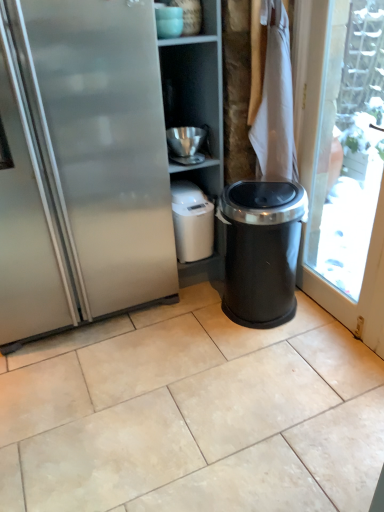
Question: Is black plastic trash can at right facing towards matte ceramic bowl at upper center, acting as the 3th appliance starting from the bottom?

Choices:
 (A) no
 (B) yes

Answer: (A)

Question: From the image's perspective, is black plastic trash can at right under matte ceramic bowl at upper center, marked as the 1th appliance in a front-to-back arrangement?

Choices:
 (A) yes
 (B) no

Answer: (A)

Question: Is black plastic trash can at right to the right of matte ceramic bowl at upper center, marked as the 1th appliance in a front-to-back arrangement, from the viewer's perspective?

Choices:
 (A) no
 (B) yes

Answer: (B)

Question: Is the position of black plastic trash can at right more distant than that of matte ceramic bowl at upper center, which is the third appliance in back-to-front order?

Choices:
 (A) no
 (B) yes

Answer: (A)

Question: Does black plastic trash can at right have a lesser height compared to matte ceramic bowl at upper center, marked as the 1th appliance in a front-to-back arrangement?

Choices:
 (A) yes
 (B) no

Answer: (B)

Question: Is black plastic trash can at right taller than matte ceramic bowl at upper center, acting as the 3th appliance starting from the bottom?

Choices:
 (A) yes
 (B) no

Answer: (A)

Question: Considering the relative sizes of metallic silver bowl at upper center, marked as the 2th appliance in a top-to-bottom arrangement, and matte ceramic bowl at upper center, the first appliance from the top, in the image provided, is metallic silver bowl at upper center, marked as the 2th appliance in a top-to-bottom arrangement, wider than matte ceramic bowl at upper center, the first appliance from the top,?

Choices:
 (A) yes
 (B) no

Answer: (A)

Question: Is metallic silver bowl at upper center, positioned as the second appliance in front-to-back order, bigger than matte ceramic bowl at upper center, the first appliance from the top?

Choices:
 (A) no
 (B) yes

Answer: (B)

Question: From the image's perspective, is metallic silver bowl at upper center, which appears as the second appliance when viewed from the back, above matte ceramic bowl at upper center, which is the third appliance in back-to-front order?

Choices:
 (A) yes
 (B) no

Answer: (B)

Question: Is metallic silver bowl at upper center, which appears as the second appliance when viewed from the back, touching matte ceramic bowl at upper center, the first appliance from the top?

Choices:
 (A) no
 (B) yes

Answer: (A)

Question: Can matte ceramic bowl at upper center, the first appliance from the top, be found inside metallic silver bowl at upper center, which appears as the second appliance when viewed from the back?

Choices:
 (A) yes
 (B) no

Answer: (B)

Question: Is metallic silver bowl at upper center, which ranks as the second appliance in bottom-to-top order, located outside matte ceramic bowl at upper center, acting as the 3th appliance starting from the bottom?

Choices:
 (A) no
 (B) yes

Answer: (B)

Question: From the image's perspective, is black plastic trash can at right on white fabric at upper right?

Choices:
 (A) no
 (B) yes

Answer: (A)